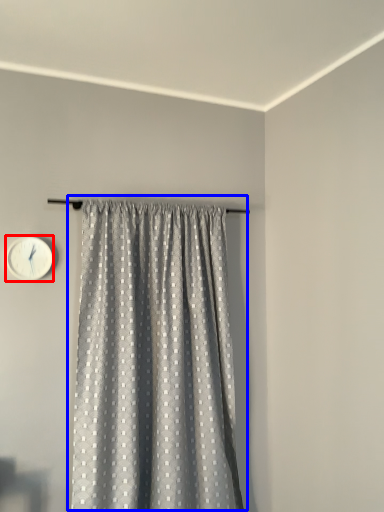
Question: Which object appears farthest to the camera in this image, wall clock (highlighted by a red box) or curtain (highlighted by a blue box)?

Choices:
 (A) wall clock
 (B) curtain

Answer: (A)